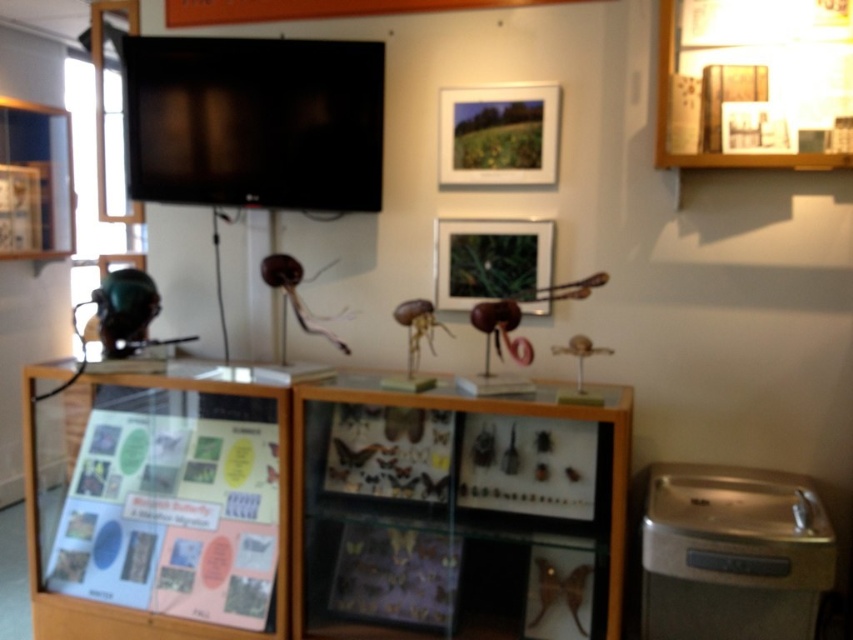
Does black glossy flat screen tv at upper left appear over matte black picture frame at center?

Indeed, black glossy flat screen tv at upper left is positioned over matte black picture frame at center.

Does black glossy flat screen tv at upper left have a lesser width compared to matte black picture frame at center?

No, black glossy flat screen tv at upper left is not thinner than matte black picture frame at center.

Who is more forward, (318, 92) or (471, 275)?

Point (318, 92)

At what (x,y) coordinates should I click in order to perform the action: click on black glossy flat screen tv at upper left. Please return your answer as a coordinate pair (x, y). Image resolution: width=853 pixels, height=640 pixels. Looking at the image, I should click on (253, 122).

Is the position of wooden frame at upper right more distant than that of matte black picture frame at center?

No, it is in front of matte black picture frame at center.

Who is more forward, (814, 42) or (471, 234)?

Positioned in front is point (814, 42).

Which is in front, point (808, 161) or point (527, 259)?

Positioned in front is point (808, 161).

Where is `wooden frame at upper right`? wooden frame at upper right is located at coordinates (755, 81).

Does wooden display case at center appear on the left side of matte wooden picture frame at upper center?

Correct, you'll find wooden display case at center to the left of matte wooden picture frame at upper center.

Between point (547, 456) and point (456, 140), which one is positioned behind?

The point (456, 140) is more distant.

Image resolution: width=853 pixels, height=640 pixels. In order to click on wooden display case at center in this screenshot , I will do `click(341, 512)`.

At what (x,y) coordinates should I click in order to perform the action: click on wooden display case at center. Please return your answer as a coordinate pair (x, y). Image resolution: width=853 pixels, height=640 pixels. Looking at the image, I should click on (341, 512).